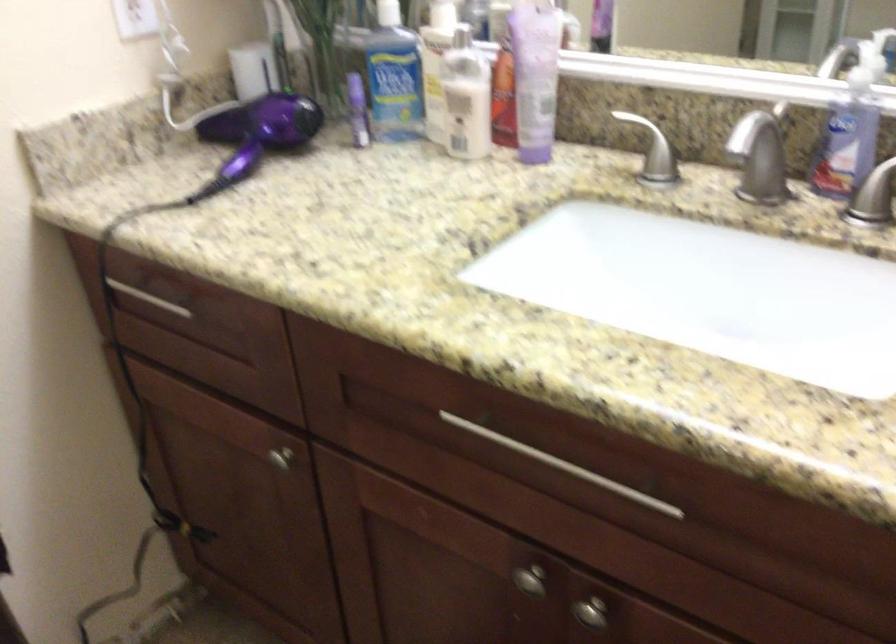
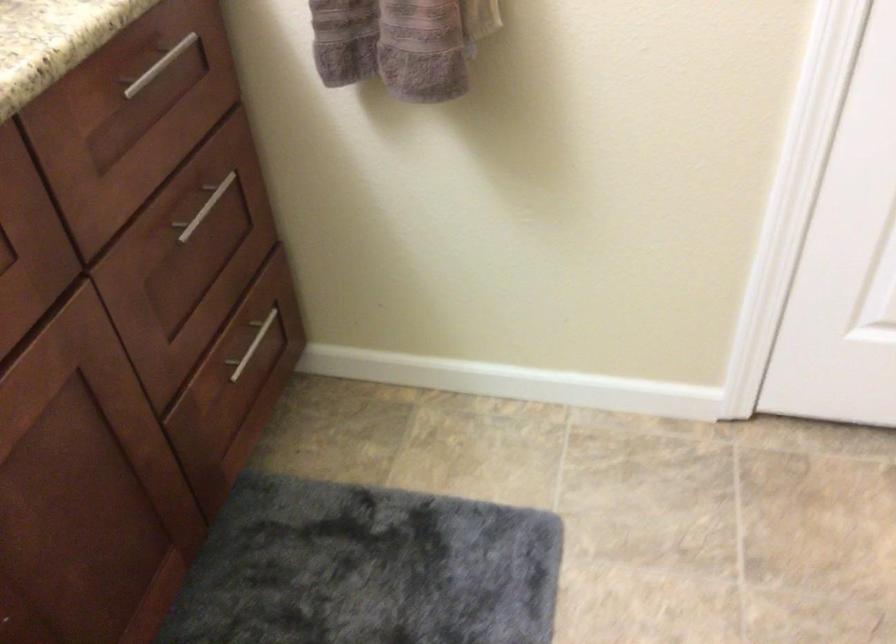
Based on the continuous images, in which direction is the camera rotating?

The camera rotated toward right-down.